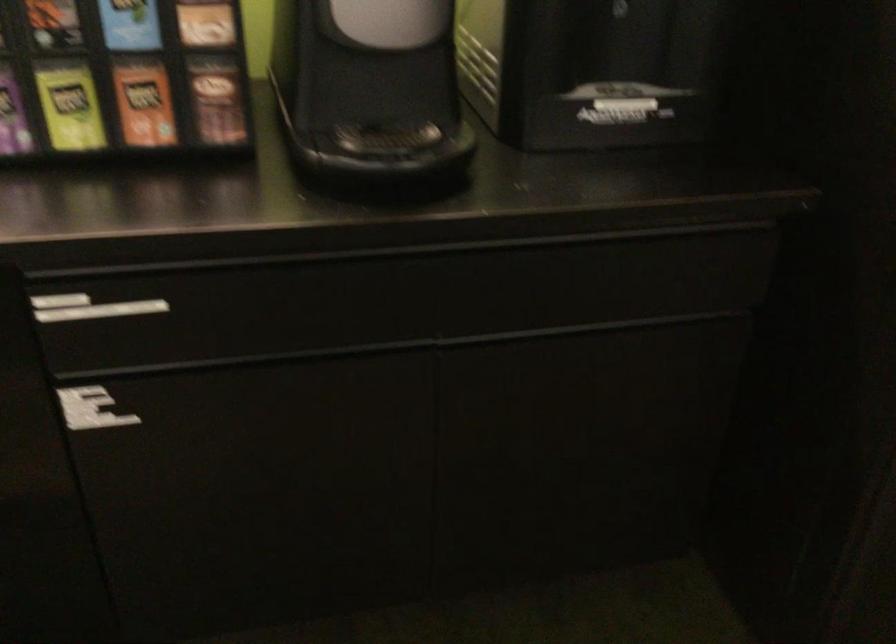
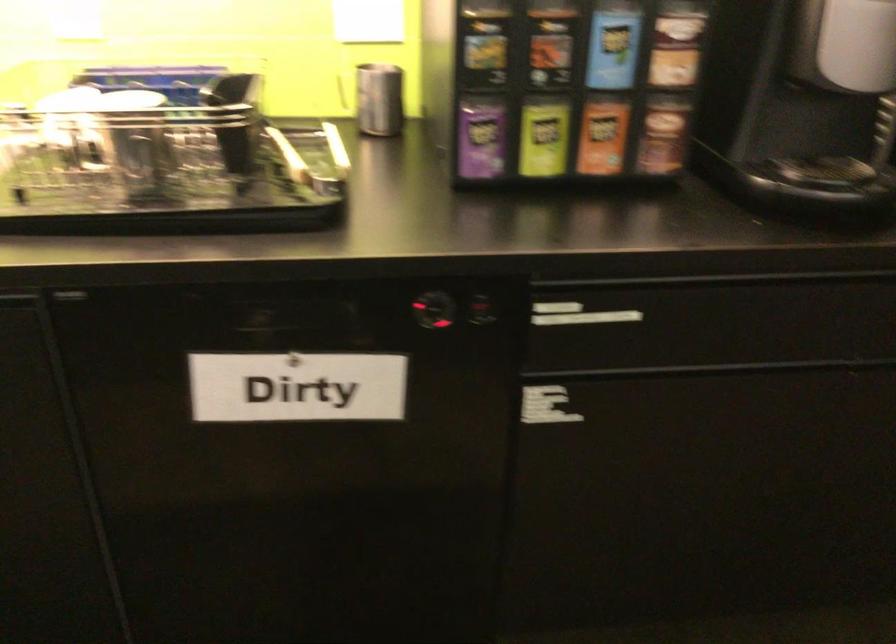
Question: The images are taken continuously from a first-person perspective. In which direction is your viewpoint rotating?

Choices:
 (A) Left
 (B) Right
 (C) Up
 (D) Down

Answer: (A)